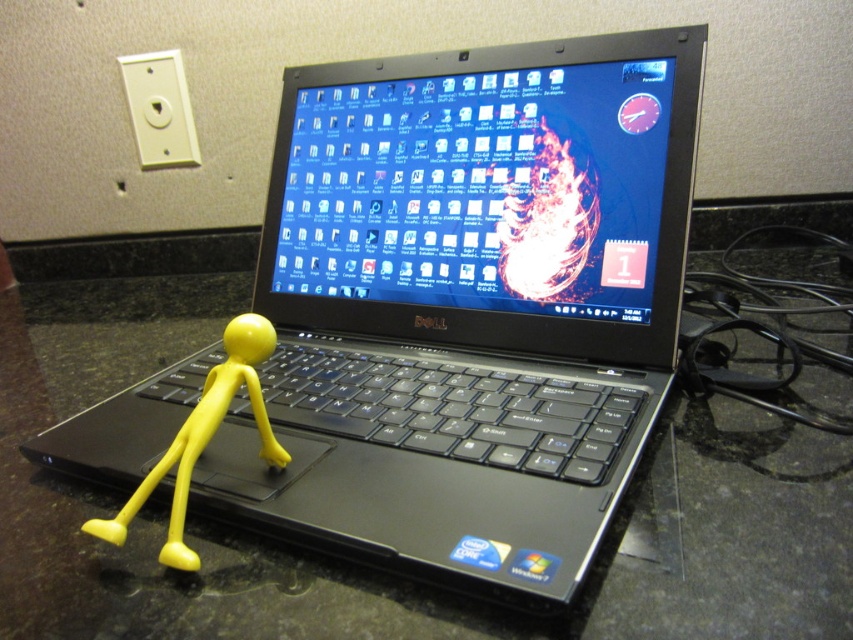
Is point (596, 342) more distant than point (241, 326)?

Yes, point (596, 342) is behind point (241, 326).

Does shiny plastic laptop at center have a lesser width compared to yellow matte stick figure at center?

No.

Is point (633, 141) farther from camera compared to point (94, 534)?

Yes, point (633, 141) is behind point (94, 534).

Identify the location of shiny plastic laptop at center. (489, 196).

Between shiny plastic laptop at center and black matte keyboard at center, which one is positioned higher?

shiny plastic laptop at center is above.

Does shiny plastic laptop at center appear on the left side of black matte keyboard at center?

No, shiny plastic laptop at center is not to the left of black matte keyboard at center.

Locate an element on the screen. Image resolution: width=853 pixels, height=640 pixels. shiny plastic laptop at center is located at coordinates pyautogui.click(x=489, y=196).

Locate an element on the screen. The width and height of the screenshot is (853, 640). shiny plastic laptop at center is located at coordinates (489, 196).

Who is positioned more to the right, black matte keyboard at center or yellow matte stick figure at center?

Positioned to the right is black matte keyboard at center.

Between black matte keyboard at center and yellow matte stick figure at center, which one appears on the left side from the viewer's perspective?

yellow matte stick figure at center

Between point (531, 465) and point (125, 531), which one is positioned in front?

Positioned in front is point (125, 531).

This screenshot has height=640, width=853. In order to click on black matte keyboard at center in this screenshot , I will do `click(451, 410)`.